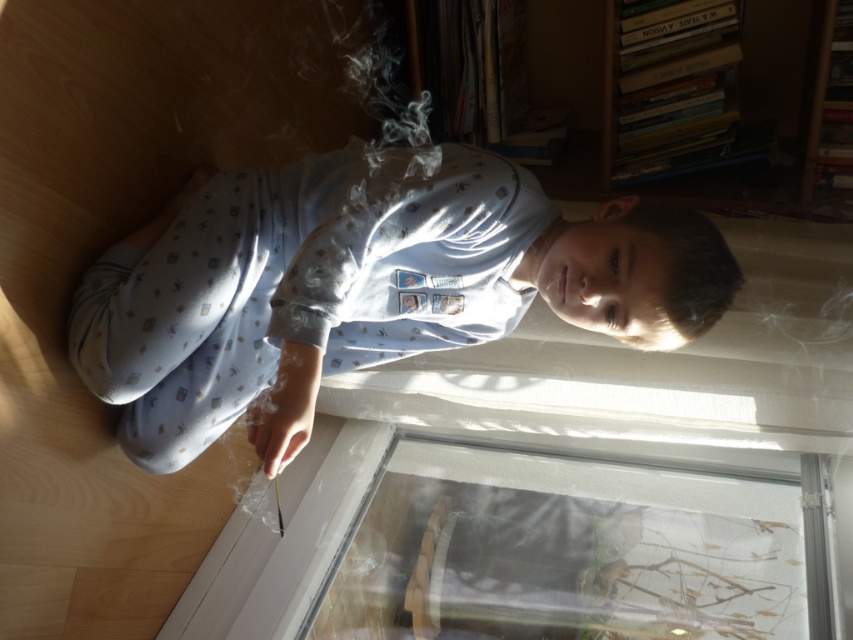
From the picture: Can you confirm if light blue cotton pajamas at center is positioned above transparent glass door at lower center?

Correct, light blue cotton pajamas at center is located above transparent glass door at lower center.

Who is taller, light blue cotton pajamas at center or transparent glass door at lower center?

light blue cotton pajamas at center is taller.

Is point (187, 266) closer to camera compared to point (531, 596)?

Yes, it is.

In order to click on light blue cotton pajamas at center in this screenshot , I will do `click(363, 288)`.

Who is positioned more to the right, transparent glass door at lower center or wooden bookshelf at upper right?

Positioned to the right is wooden bookshelf at upper right.

Is point (606, 465) behind point (811, 60)?

No, it is not.

Where is `transparent glass door at lower center`? transparent glass door at lower center is located at coordinates (573, 550).

Can you confirm if light blue cotton pajamas at center is positioned to the left of wooden bookshelf at upper right?

Correct, you'll find light blue cotton pajamas at center to the left of wooden bookshelf at upper right.

Is light blue cotton pajamas at center above wooden bookshelf at upper right?

Incorrect, light blue cotton pajamas at center is not positioned above wooden bookshelf at upper right.

Is point (509, 301) less distant than point (798, 122)?

Yes, it is.

You are a GUI agent. You are given a task and a screenshot of the screen. Output one action in this format:
    pyautogui.click(x=<x>, y=<y>)
    Task: Click on the light blue cotton pajamas at center
    
    Given the screenshot: What is the action you would take?
    pyautogui.click(x=363, y=288)